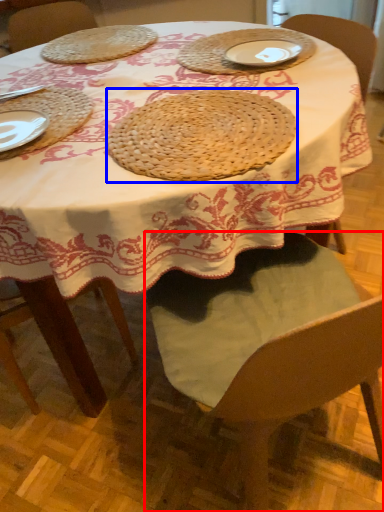
Question: Among these objects, which one is nearest to the camera, chair (highlighted by a red box) or pie (highlighted by a blue box)?

Choices:
 (A) chair
 (B) pie

Answer: (A)